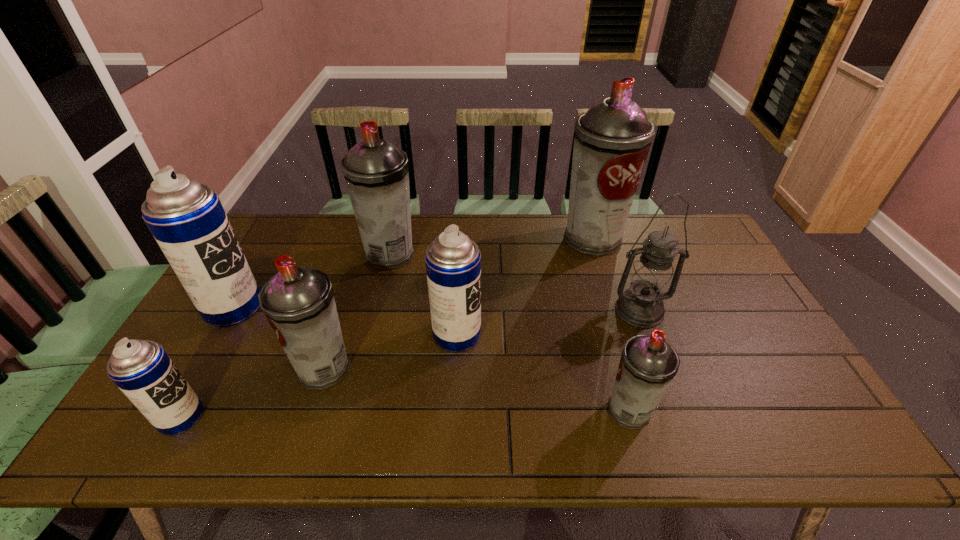
Identify the location of vacant region between the gray oil lamp and the tallest object. The height and width of the screenshot is (540, 960). (615, 274).

Image resolution: width=960 pixels, height=540 pixels. In order to click on vacant space that's between the second biggest blue aerosol can and the oil lamp in this screenshot , I will do `click(548, 322)`.

Locate which object ranks fifth in proximity to the smallest gray aerosol can. Please provide its 2D coordinates. Your answer should be formatted as a tuple, i.e. [(x, y)], where the tuple contains the x and y coordinates of a point satisfying the conditions above.

[(376, 173)]

Identify which object is the sixth nearest to the smallest blue aerosol can. Please provide its 2D coordinates. Your answer should be formatted as a tuple, i.e. [(x, y)], where the tuple contains the x and y coordinates of a point satisfying the conditions above.

[(651, 280)]

Identify which aerosol can is located as the fifth nearest to the smallest blue aerosol can. Please provide its 2D coordinates. Your answer should be formatted as a tuple, i.e. [(x, y)], where the tuple contains the x and y coordinates of a point satisfying the conditions above.

[(648, 364)]

You are a GUI agent. You are given a task and a screenshot of the screen. Output one action in this format:
    pyautogui.click(x=<x>, y=<y>)
    Task: Click on the third closest aerosol can to the tallest object
    The width and height of the screenshot is (960, 540).
    Given the screenshot: What is the action you would take?
    pyautogui.click(x=648, y=364)

Identify the location of the third closest gray aerosol can relative to the tallest object. (298, 302).

Locate which gray aerosol can ranks third in proximity to the biggest gray aerosol can. Please provide its 2D coordinates. Your answer should be formatted as a tuple, i.e. [(x, y)], where the tuple contains the x and y coordinates of a point satisfying the conditions above.

[(298, 302)]

In order to click on blue aerosol can object that ranks as the second closest to the gray oil lamp in this screenshot , I will do `click(186, 218)`.

Identify which blue aerosol can is the third closest to the smallest gray aerosol can. Please provide its 2D coordinates. Your answer should be formatted as a tuple, i.e. [(x, y)], where the tuple contains the x and y coordinates of a point satisfying the conditions above.

[(186, 218)]